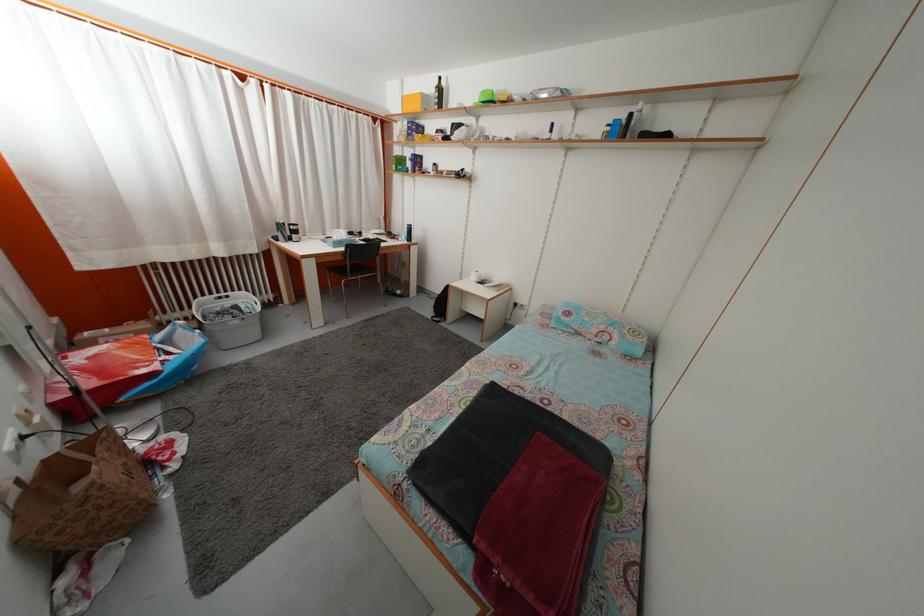
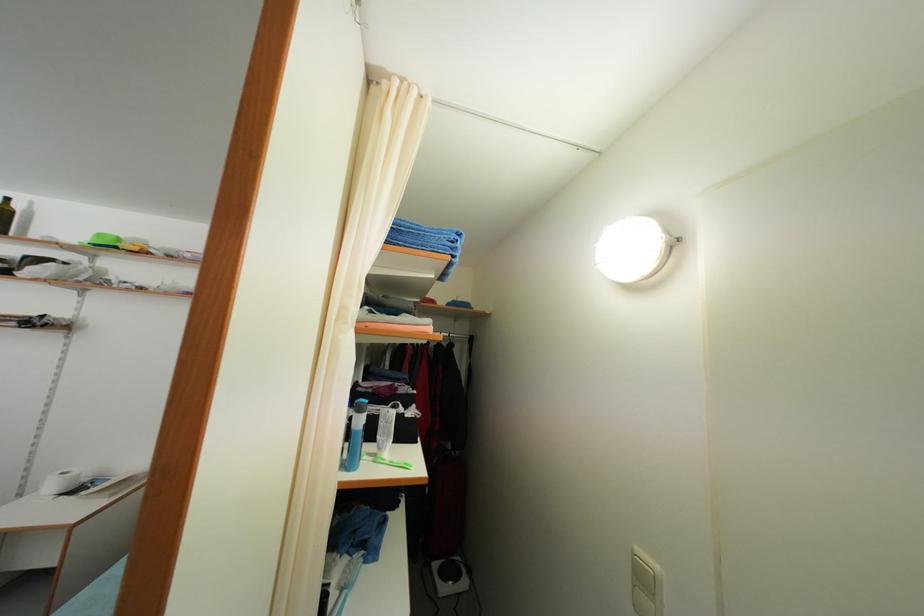
The point at (480,285) is marked in the first image. Where is the corresponding point in the second image?

(56, 493)